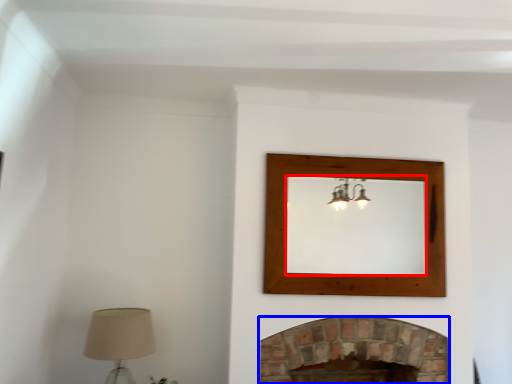
Question: Which object appears farthest to the camera in this image, mirror (highlighted by a red box) or fireplace (highlighted by a blue box)?

Choices:
 (A) mirror
 (B) fireplace

Answer: (A)